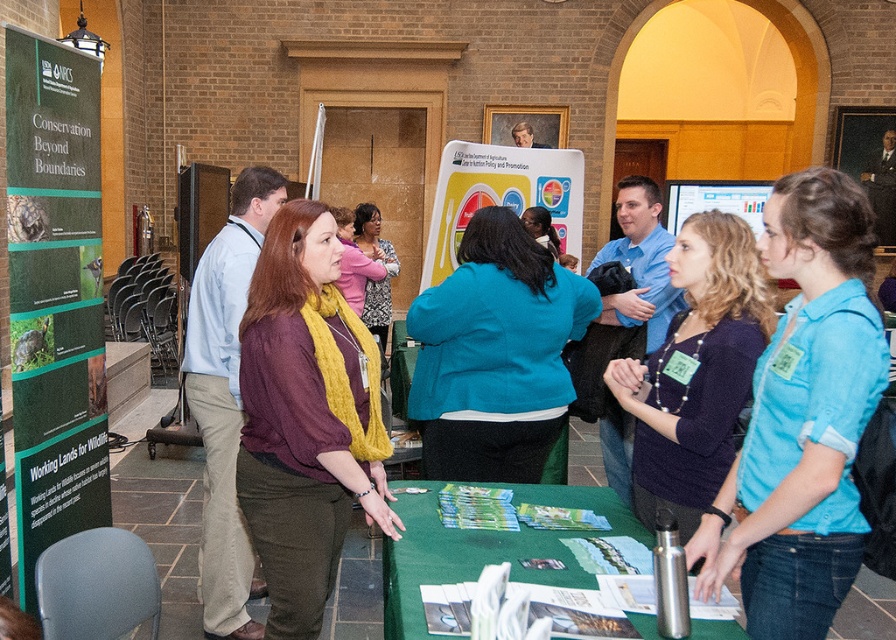
Question: In this image, where is green matte poster at left located relative to green fabric table at center?

Choices:
 (A) below
 (B) above

Answer: (B)

Question: Which point is closer to the camera?

Choices:
 (A) (743, 356)
 (B) (279, 566)
 (C) (820, 388)
 (D) (480, 564)

Answer: (C)

Question: Can you confirm if maroon knit sweater at center is smaller than teal woolen jacket at center?

Choices:
 (A) yes
 (B) no

Answer: (A)

Question: Which object is the closest to the teal woolen jacket at center?

Choices:
 (A) blue shirt at center
 (B) dark blue sweater at center
 (C) green fabric table at center

Answer: (C)

Question: Which is nearer to the blue shirt at center?

Choices:
 (A) maroon knit sweater at center
 (B) teal woolen jacket at center
 (C) green fabric table at center
 (D) green matte poster at left

Answer: (C)

Question: Does teal woolen jacket at center come in front of dark blue sweater at center?

Choices:
 (A) no
 (B) yes

Answer: (A)